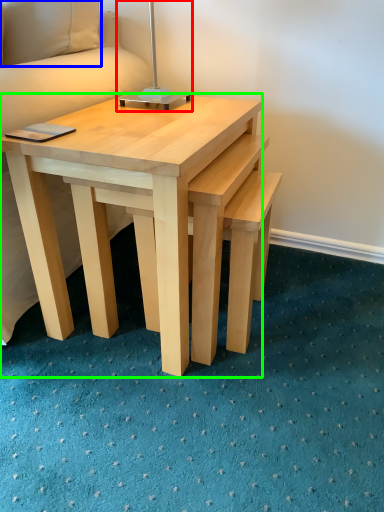
Question: Which object is positioned closest to bedside lamp (highlighted by a red box)? Select from pillow (highlighted by a blue box) and coffee table (highlighted by a green box).

Choices:
 (A) pillow
 (B) coffee table

Answer: (A)